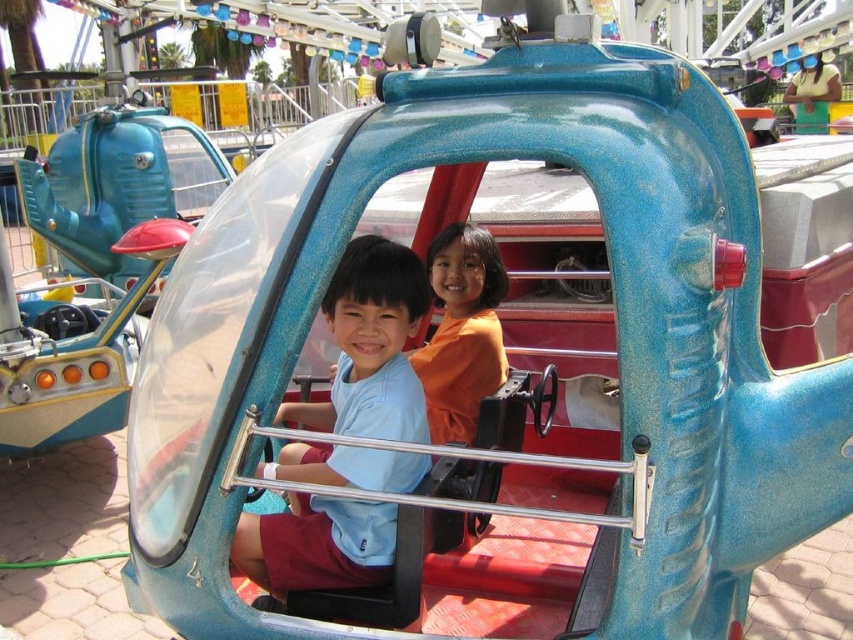
You are standing at the point marked by the coordinate point at point (300,563). You want to walk to the nearest exit, which is located 10 feet away from you. However, there is an obstacle 5 feet away from your current position. Can you safely navigate around the obstacle to reach the exit?

Since the obstacle is 5 feet away and the exit is 10 feet away, you can safely navigate around the obstacle to reach the exit as long as there is enough space to maneuver around it without going beyond the 10 feet distance required to reach the exit.

You are a photographer at the fairground. You want to take a photo of the two children in the ride so that both their shirts are visible. Given the positions of the matte blue shirt at center and orange matte shirt at center, which child should you position lower in the frame to ensure both shirts are visible?

The matte blue shirt at center is located below the orange matte shirt at center. To ensure both shirts are visible, you should position the child with the matte blue shirt at center lower in the frame since it is already below the orange matte shirt at center.

You are standing in front of the helicopter ride at the fairground. There are two points marked on the ride. The first point is at coordinates point (355,291) and the second point is at point (482,298). Which point is closer to you?

Point (355,291) is closer to the camera than point (482,298).